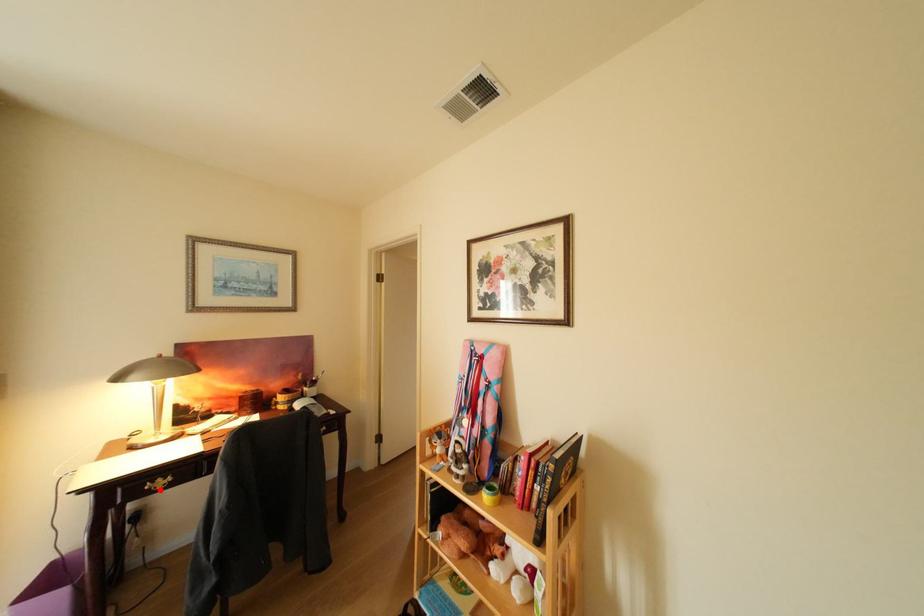
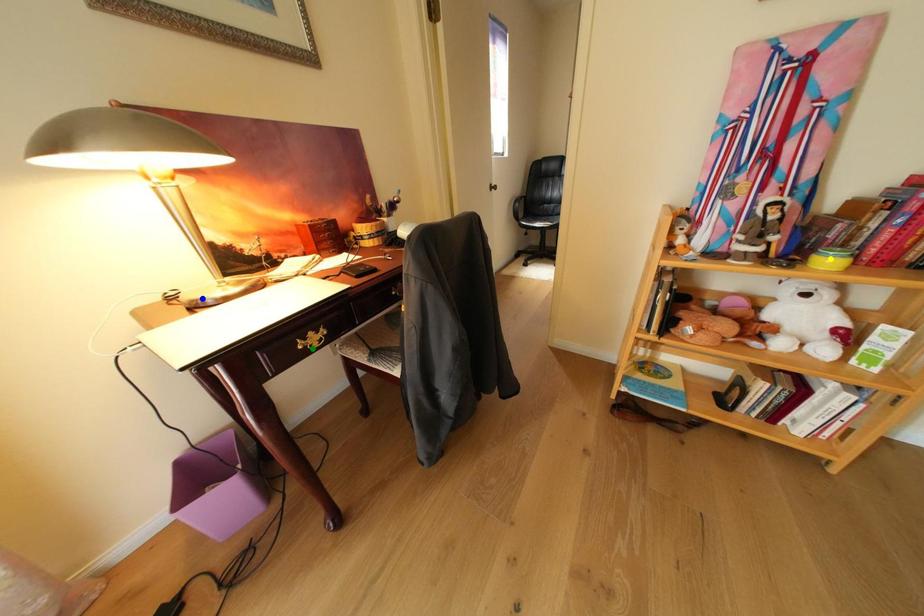
Question: I am providing you with two images of the same scene from different viewpoints. A red point is marked on the first image. You are given multiple points on the second image. Which point in image 2 represents the same 3d spot as the red point in image 1?

Choices:
 (A) blue point
 (B) green point
 (C) yellow point

Answer: (B)